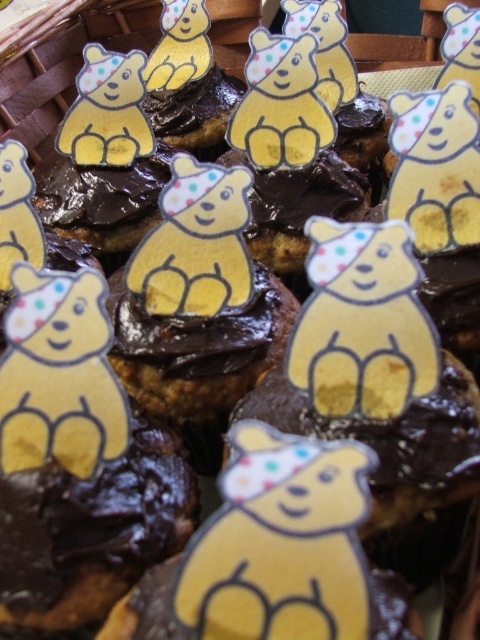
You are arranging cupcakes for a charity event and need to place a new cupcake between the yellow paper bear at center and the matte yellow bear at upper right. Based on their positions, where should you place the new cupcake?

The new cupcake should be placed to the right of the yellow paper bear at center and to the left of the matte yellow bear at upper right, as the yellow paper bear at center is positioned to the left of the matte yellow bear at upper right.

You are a guest at a charity event and see two cupcakes with bear toppers. The cupcakes are arranged in a basket partially visible at the top left corner. You want to pick the cupcake that is closer to you. Which one should you choose between the yellow paper bear at center and the matte yellow bear at upper left?

The yellow paper bear at center is closer to you because it is in front of the matte yellow bear at upper left.